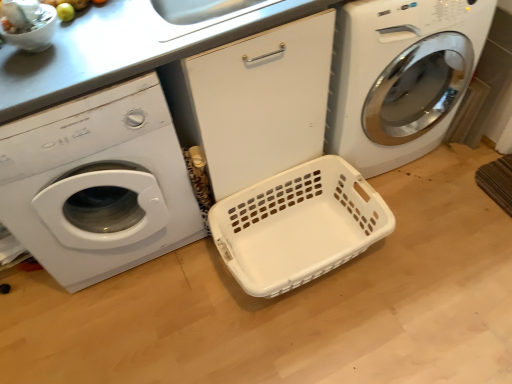
Locate an element on the screen. The width and height of the screenshot is (512, 384). vacant space to the left of white plastic basket at center is located at coordinates (176, 314).